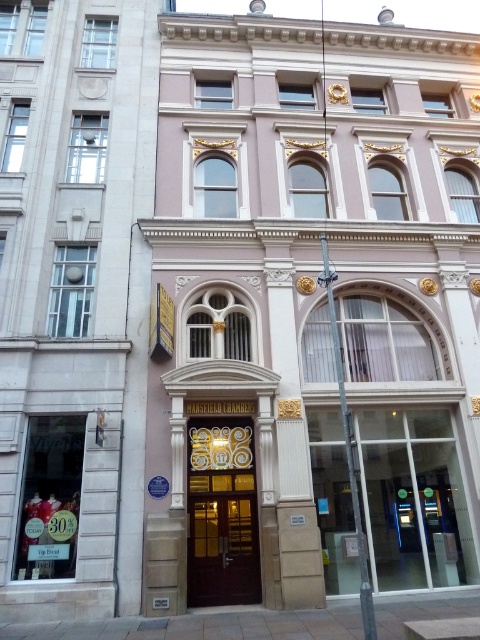
Is matte stone building at center taller than gold ornate door at center?

Correct, matte stone building at center is much taller as gold ornate door at center.

Is matte stone building at center shorter than gold ornate door at center?

No, matte stone building at center is not shorter than gold ornate door at center.

Which is behind, point (26, 493) or point (213, 508)?

Positioned behind is point (213, 508).

The height and width of the screenshot is (640, 480). Find the location of `matte stone building at center`. matte stone building at center is located at coordinates (74, 300).